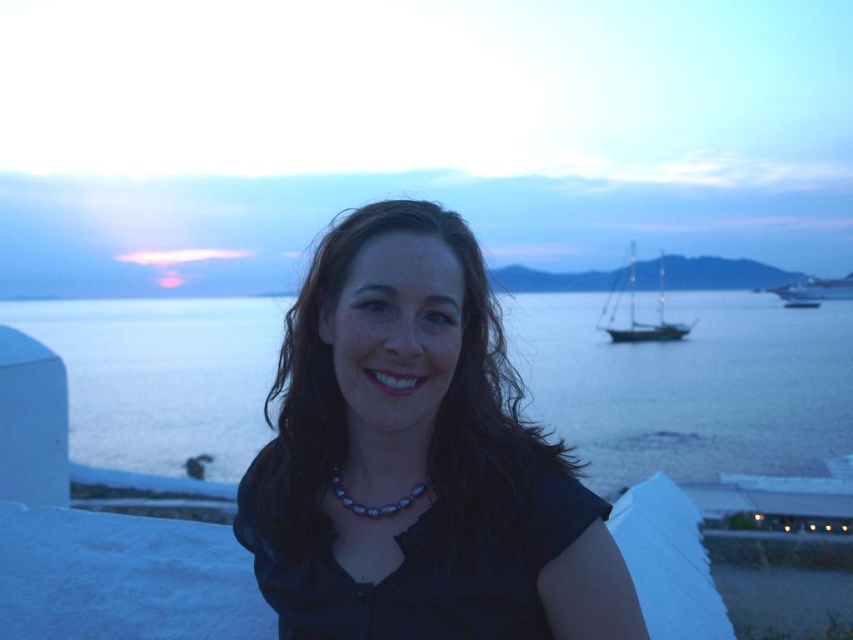
Question: Which point is closer to the camera?

Choices:
 (A) (355, 509)
 (B) (695, 349)

Answer: (A)

Question: Which object is closer to the camera taking this photo?

Choices:
 (A) blue water at center
 (B) sailboat at right
 (C) pearl-like beads necklace at center

Answer: (C)

Question: Can you confirm if pearl-like beads necklace at center is thinner than shiny silver sailboat at right?

Choices:
 (A) no
 (B) yes

Answer: (B)

Question: Which object appears farthest from the camera in this image?

Choices:
 (A) sailboat at right
 (B) matte black shirt at center
 (C) shiny silver sailboat at right

Answer: (C)

Question: Does sailboat at right come behind pearl-like beads necklace at center?

Choices:
 (A) no
 (B) yes

Answer: (B)

Question: Is blue water at center bigger than shiny silver sailboat at right?

Choices:
 (A) no
 (B) yes

Answer: (B)